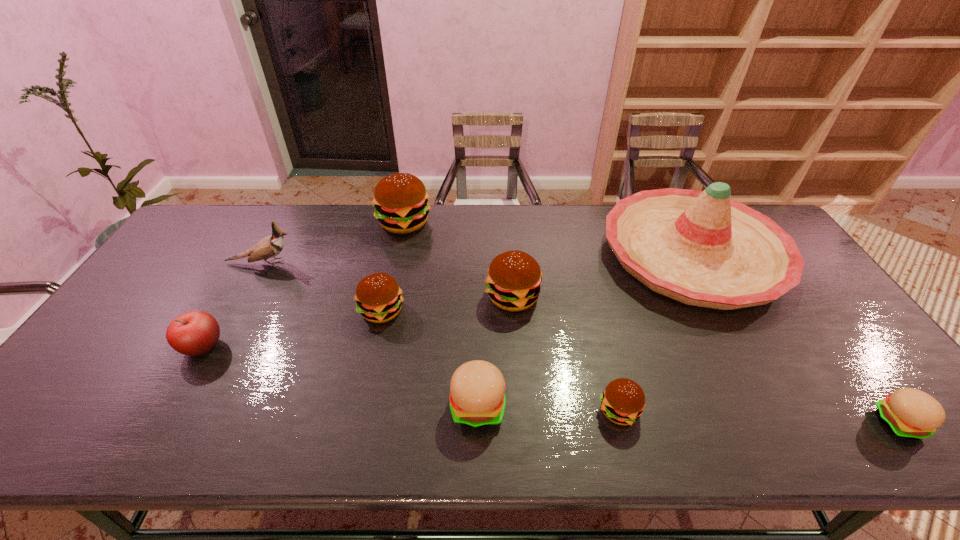
At what (x,y) coordinates should I click in order to perform the action: click on free spot at the far edge of the desktop. Please return your answer as a coordinate pair (x, y). Looking at the image, I should click on (437, 212).

In the image, there is a desktop. Find the location of `vacant space at the near edge`. vacant space at the near edge is located at coordinates (179, 415).

Where is `free space at the left edge of the desktop`? The height and width of the screenshot is (540, 960). free space at the left edge of the desktop is located at coordinates (105, 407).

You are a GUI agent. You are given a task and a screenshot of the screen. Output one action in this format:
    pyautogui.click(x=<x>, y=<y>)
    Task: Click on the vacant space at the right edge
    
    Given the screenshot: What is the action you would take?
    pyautogui.click(x=885, y=376)

Identify the location of vacant area that lies between the left beige hamburger and the farthest hamburger. Image resolution: width=960 pixels, height=540 pixels. (441, 314).

This screenshot has width=960, height=540. I want to click on free spot between the third biggest brown hamburger and the red apple, so (292, 329).

Locate an element on the screen. The image size is (960, 540). free space between the bird and the fifth hamburger from left to right is located at coordinates (441, 337).

Locate an element on the screen. The width and height of the screenshot is (960, 540). unoccupied position between the bigger beige hamburger and the third brown hamburger from left to right is located at coordinates (495, 351).

Locate an element on the screen. The height and width of the screenshot is (540, 960). vacant space that's between the left beige hamburger and the nearest brown hamburger is located at coordinates (548, 408).

Image resolution: width=960 pixels, height=540 pixels. I want to click on free space between the apple and the smaller beige hamburger, so click(x=551, y=385).